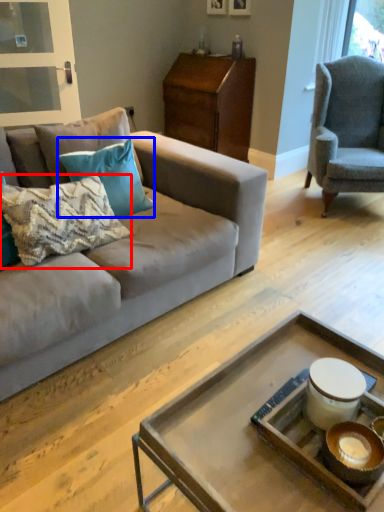
Question: Which object appears closest to the camera in this image, pillow (highlighted by a red box) or pillow (highlighted by a blue box)?

Choices:
 (A) pillow
 (B) pillow

Answer: (A)